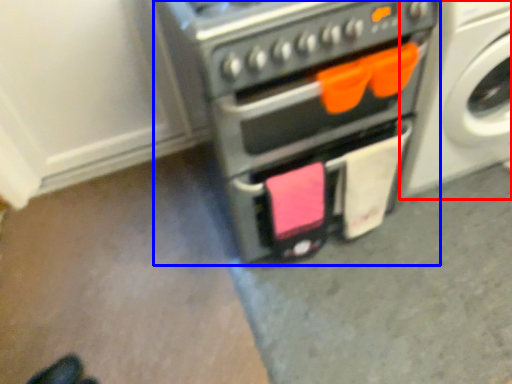
Question: Which of the following is the farthest to the observer, washing machine (highlighted by a red box) or home appliance (highlighted by a blue box)?

Choices:
 (A) washing machine
 (B) home appliance

Answer: (A)